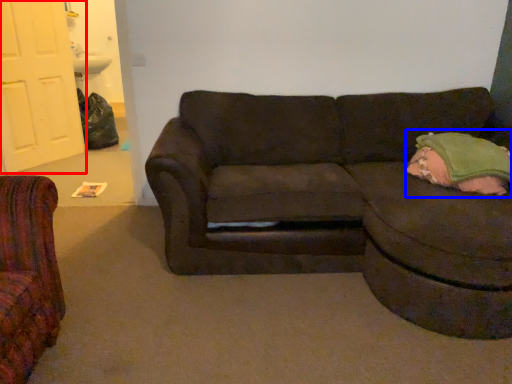
Question: Which object appears farthest to the camera in this image, door (highlighted by a red box) or pillow (highlighted by a blue box)?

Choices:
 (A) door
 (B) pillow

Answer: (A)